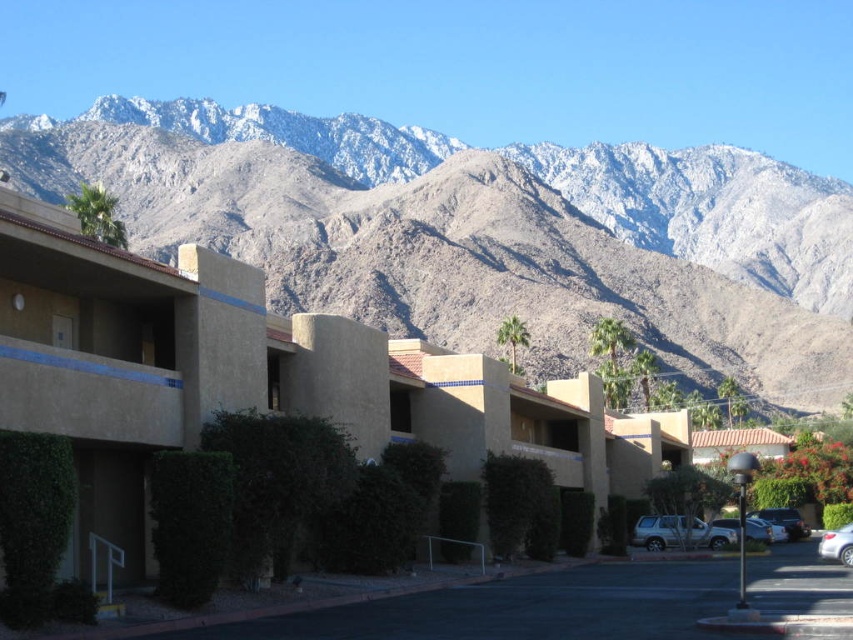
You are standing at the point marked as point (520, 506) in the image. Based on the scene description, what is the immediate object beneath your feet?

The immediate object beneath your feet at point (520, 506) is the green leafy hedge at center.

You are a pedestrian standing at the edge of the street. You see the green leafy hedge at center and the white glossy sedan at lower right. Which object is closer to your left side?

The green leafy hedge at center is to the left of white glossy sedan at lower right, so it is closer to your left side.

You are a pedestrian standing on the sidewalk in front of the buildings. You see the green leafy hedge at center and the white glossy sedan at lower right. Which object is closer to you?

The white glossy sedan at lower right is closer to you because the green leafy hedge at center is located above it, meaning the sedan is positioned in front of the hedge from your viewpoint.